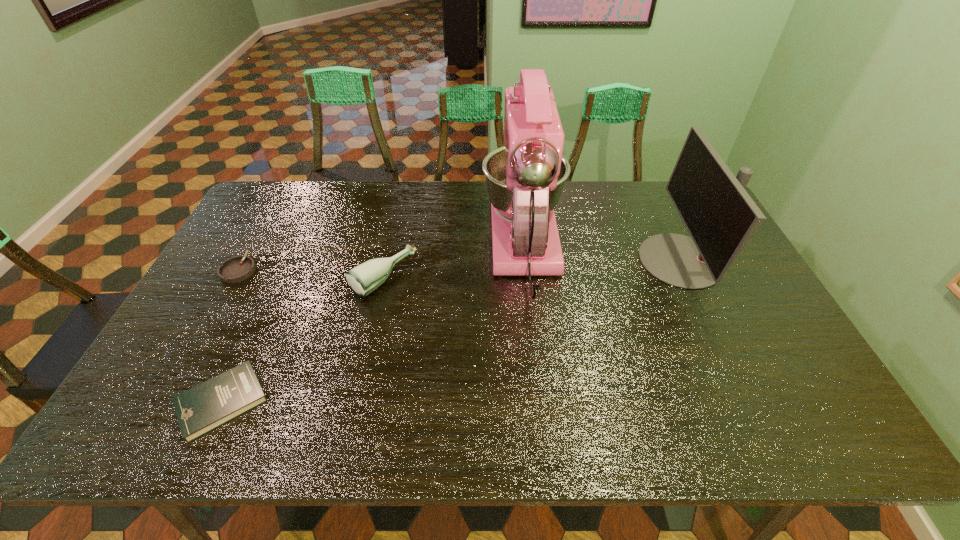
Where is `free space located on the screen of the computer monitor`? The width and height of the screenshot is (960, 540). free space located on the screen of the computer monitor is located at coordinates (620, 260).

What are the coordinates of `free space located on the screen of the computer monitor` in the screenshot? It's located at (535, 260).

In order to click on vacant region located on the screen of the computer monitor in this screenshot , I will do `click(600, 260)`.

You are a GUI agent. You are given a task and a screenshot of the screen. Output one action in this format:
    pyautogui.click(x=<x>, y=<y>)
    Task: Click on the free space located 0.140m on the back of the third tallest object
    
    Given the screenshot: What is the action you would take?
    (x=395, y=228)

The height and width of the screenshot is (540, 960). I want to click on free space located on the back of the second shortest object, so click(x=276, y=203).

At what (x,y) coordinates should I click in order to perform the action: click on free region located on the back of the book. Please return your answer as a coordinate pair (x, y). The height and width of the screenshot is (540, 960). Looking at the image, I should click on (254, 330).

The height and width of the screenshot is (540, 960). Find the location of `mixer at the far edge`. mixer at the far edge is located at coordinates (525, 178).

At what (x,y) coordinates should I click in order to perform the action: click on computer monitor that is at the far edge. Please return your answer as a coordinate pair (x, y). The height and width of the screenshot is (540, 960). Looking at the image, I should click on (720, 216).

What are the coordinates of `object that is at the near edge` in the screenshot? It's located at (199, 410).

At what (x,y) coordinates should I click in order to perform the action: click on ashtray that is at the left edge. Please return your answer as a coordinate pair (x, y). The height and width of the screenshot is (540, 960). Looking at the image, I should click on (238, 268).